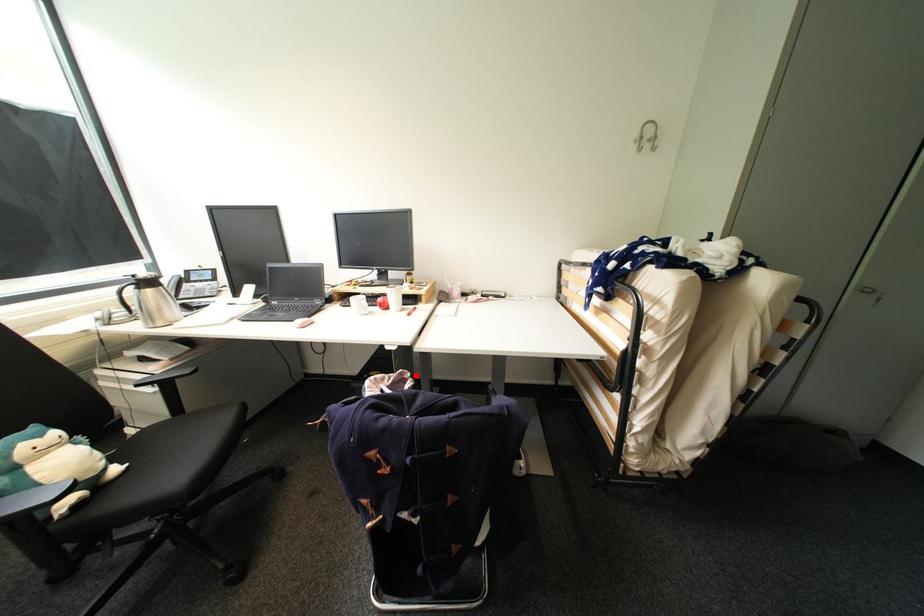
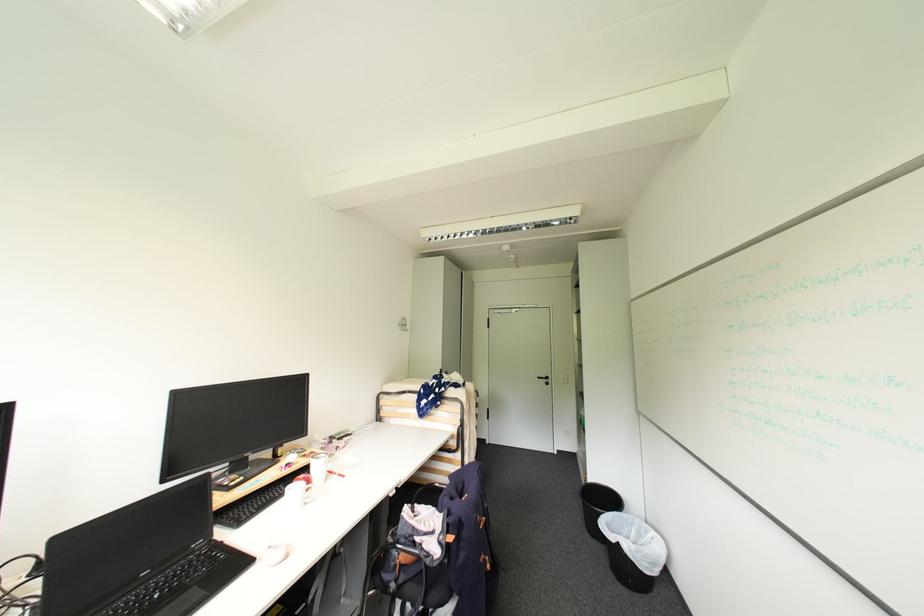
Find the pixel in the second image that matches the highlighted location in the first image.

(417, 506)